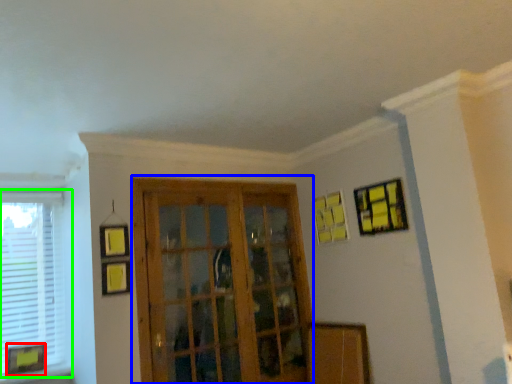
Question: Which is nearer to the picture frame (highlighted by a red box)? screen door (highlighted by a blue box) or window (highlighted by a green box).

Choices:
 (A) screen door
 (B) window

Answer: (B)